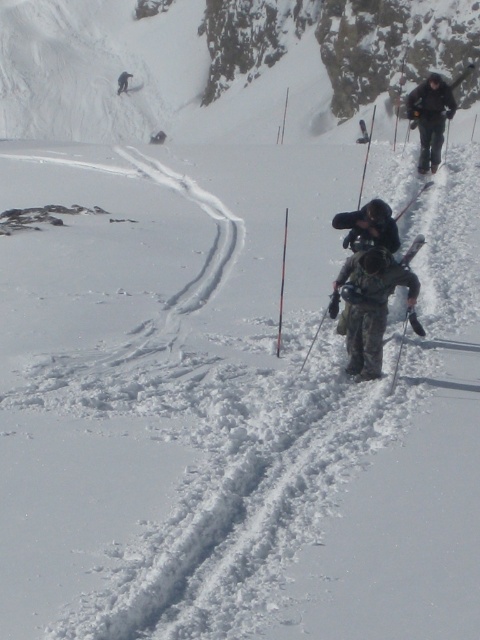
Can you confirm if black matte backpack at center is thinner than dark gray snowsuit at upper center?

Yes, black matte backpack at center is thinner than dark gray snowsuit at upper center.

Between point (348, 212) and point (132, 76), which one is positioned in front?

Positioned in front is point (348, 212).

Who is more distant from viewer, [339,218] or [120,88]?

Positioned behind is point [120,88].

I want to click on black matte backpack at center, so click(x=369, y=225).

Does camouflage fabric jacket at center have a smaller size compared to dark gray snowsuit at upper center?

Correct, camouflage fabric jacket at center occupies less space than dark gray snowsuit at upper center.

Does camouflage fabric jacket at center appear over dark gray snowsuit at upper center?

Actually, camouflage fabric jacket at center is below dark gray snowsuit at upper center.

Identify the location of camouflage fabric jacket at center. (370, 305).

Which is behind, point (436, 122) or point (126, 88)?

The point (126, 88) is more distant.

Is black fabric jacket at upper right to the left of dark gray snowsuit at upper center from the viewer's perspective?

In fact, black fabric jacket at upper right is to the right of dark gray snowsuit at upper center.

Is point (441, 122) in front of point (123, 90)?

Yes, point (441, 122) is closer to viewer.

Locate an element on the screen. This screenshot has width=480, height=640. black fabric jacket at upper right is located at coordinates (430, 116).